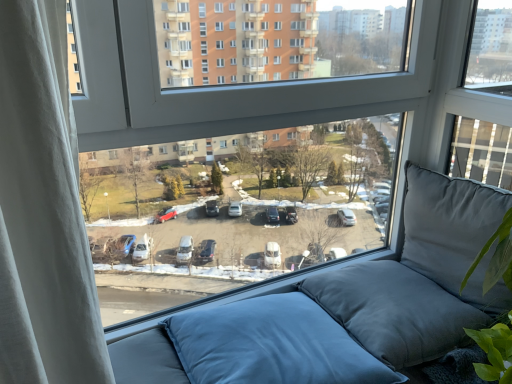
Locate an element on the screen. The height and width of the screenshot is (384, 512). empty space that is ontop of blue fabric pillow at lower center, the first pillow from the left (from a real-world perspective) is located at coordinates (270, 333).